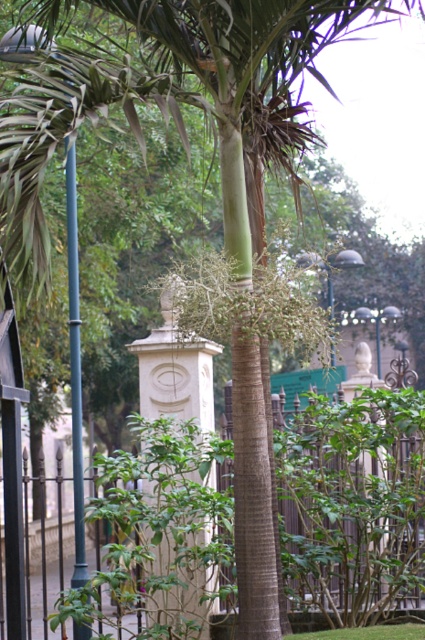
You are standing in the outdoor scene and want to walk from the metallic pole at left to the black metal fence at center. Which direction should you move relative to the pole?

To move from the metallic pole at left to the black metal fence at center, you should move to the right since the black metal fence at center is positioned on the right side of the metallic pole at left.

You are a gardener standing in the middle of the scene. You need to water the palm tree but there is a black metal fence at center and a metallic pole at left in your way. Which object is closer to you so you can move around it?

The black metal fence at center is closer to you than the metallic pole at left, so you can move around the black metal fence at center first.

You are standing in the garden where the palm tree is located. You see the black metal fence at center and the metallic pole at left. Which object is closer to you?

The black metal fence at center is closer to you because it is positioned over the metallic pole at left, indicating it is in front.